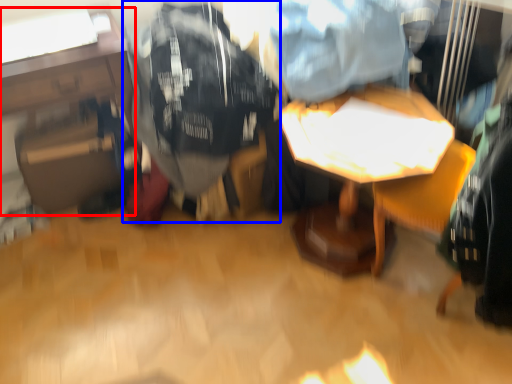
Question: Among these objects, which one is nearest to the camera, table (highlighted by a red box) or clothing (highlighted by a blue box)?

Choices:
 (A) table
 (B) clothing

Answer: (B)